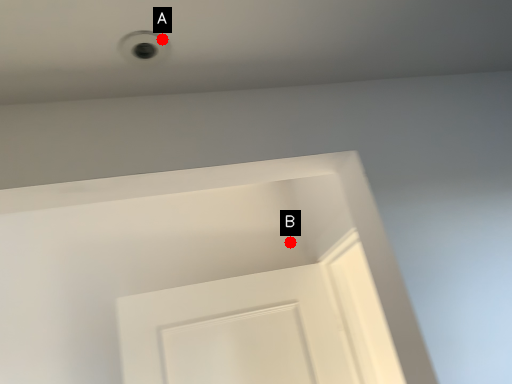
Question: Two points are circled on the image, labeled by A and B beside each circle. Which point is farther from the camera taking this photo?

Choices:
 (A) A is further
 (B) B is further

Answer: (B)